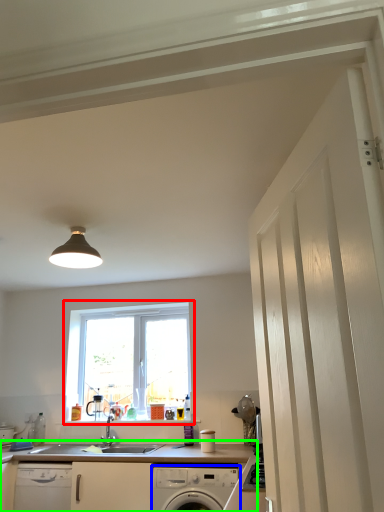
Question: Which object is positioned farthest from window (highlighted by a red box)? Select from home appliance (highlighted by a blue box) and countertop (highlighted by a green box).

Choices:
 (A) home appliance
 (B) countertop

Answer: (A)